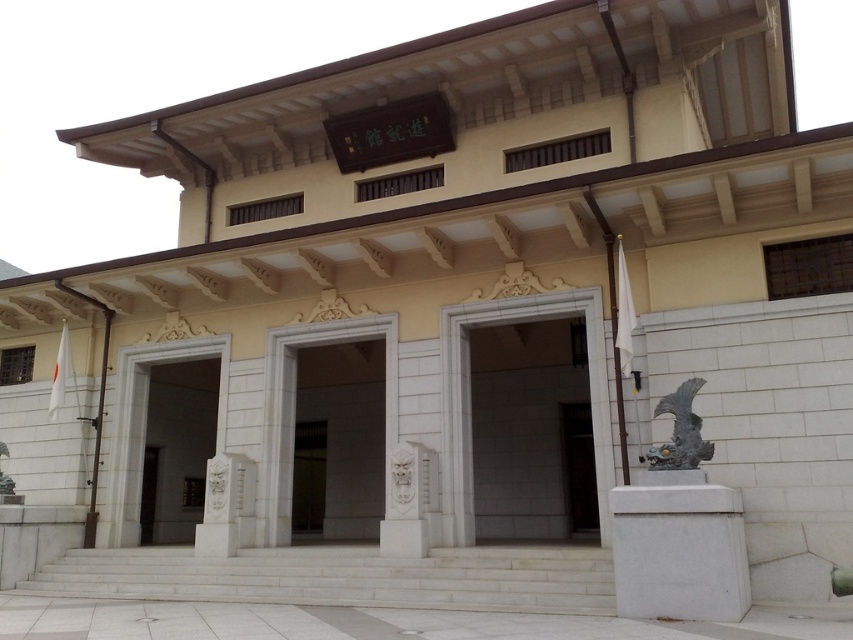
You are standing in front of the traditional East Asian building and want to locate two specific points marked on the facade. The first point is at coordinates point (485,372) and the second is at point (380,400). Which of these points is closer to your current position?

Point (485,372) is closer to the viewer than point (380,400).

You are standing at point [344,577] in the image of the traditional building. What object is located exactly at this point?

The white marble stairs at center are located exactly at point [344,577].